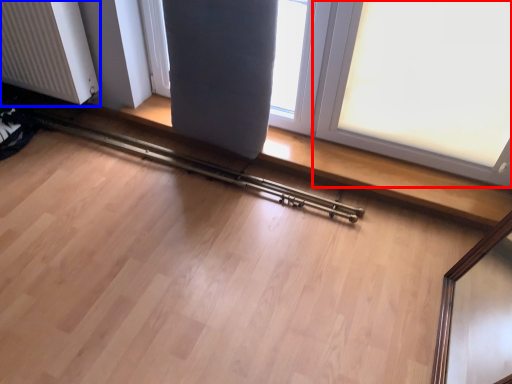
Question: Which of the following is the farthest to the observer, window (highlighted by a red box) or radiator (highlighted by a blue box)?

Choices:
 (A) window
 (B) radiator

Answer: (B)